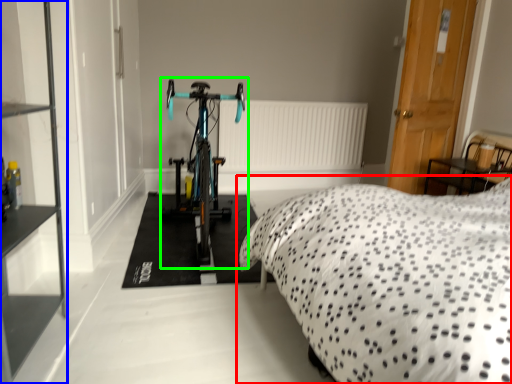
Question: Which object is positioned farthest from bed (highlighted by a red box)? Select from shelf (highlighted by a blue box) and bicycle (highlighted by a green box).

Choices:
 (A) shelf
 (B) bicycle

Answer: (A)